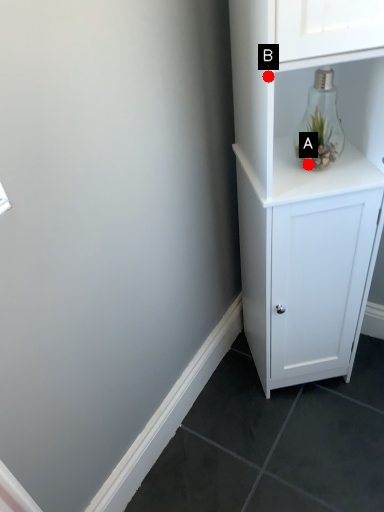
Question: Two points are circled on the image, labeled by A and B beside each circle. Which point is further to the camera?

Choices:
 (A) A is further
 (B) B is further

Answer: (A)